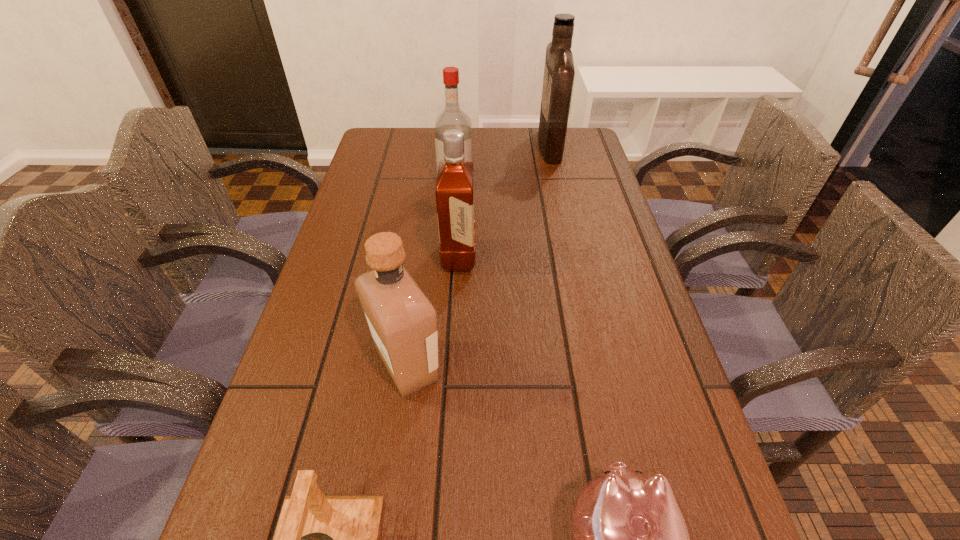
Locate an element on the screen. Image resolution: width=960 pixels, height=540 pixels. vacant space located 0.300m on the front-facing side of the nearest liquor is located at coordinates (602, 367).

This screenshot has height=540, width=960. Identify the location of object located in the far edge section of the desktop. (559, 71).

This screenshot has height=540, width=960. Find the location of `object positioned at the left edge`. object positioned at the left edge is located at coordinates (402, 321).

Locate an element on the screen. object at the right edge is located at coordinates (559, 71).

Where is `object that is at the far right corner`? Image resolution: width=960 pixels, height=540 pixels. object that is at the far right corner is located at coordinates (559, 71).

The height and width of the screenshot is (540, 960). In the image, there is a desktop. Find the location of `free space at the far edge`. free space at the far edge is located at coordinates (507, 143).

What are the coordinates of `vacant space at the left edge of the desktop` in the screenshot? It's located at (258, 517).

This screenshot has width=960, height=540. In the image, there is a desktop. Identify the location of free region at the right edge. (667, 358).

Identify the location of vacant area at the far left corner. (375, 157).

Locate an element on the screen. unoccupied position between the fourth farthest object and the second farthest liquor is located at coordinates (432, 274).